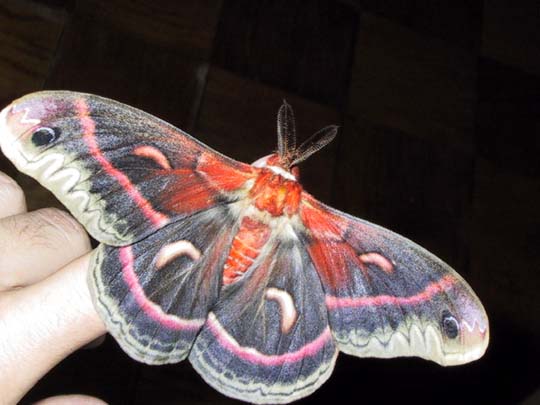
This screenshot has height=405, width=540. I want to click on floor, so click(390, 111).